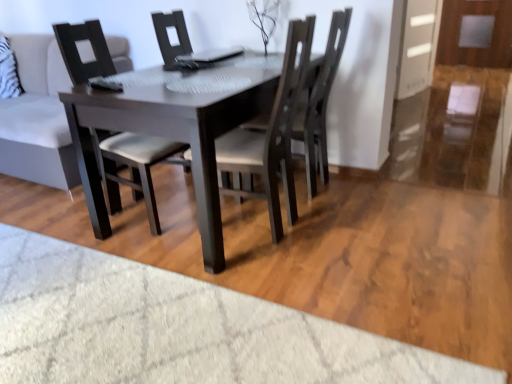
Locate an element on the screen. This screenshot has height=384, width=512. vacant space in front of matte black chair at center, the 3th chair in the right-to-left sequence is located at coordinates (96, 268).